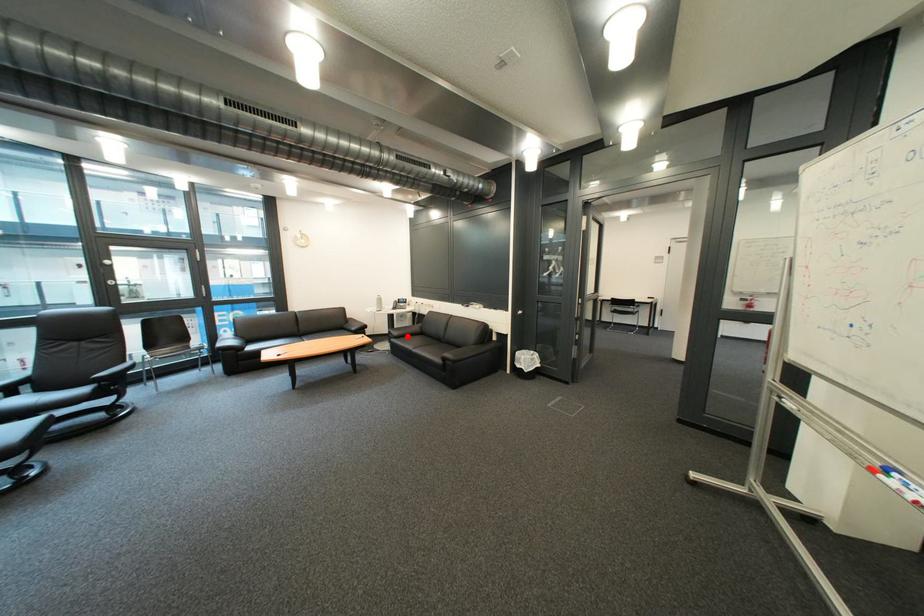
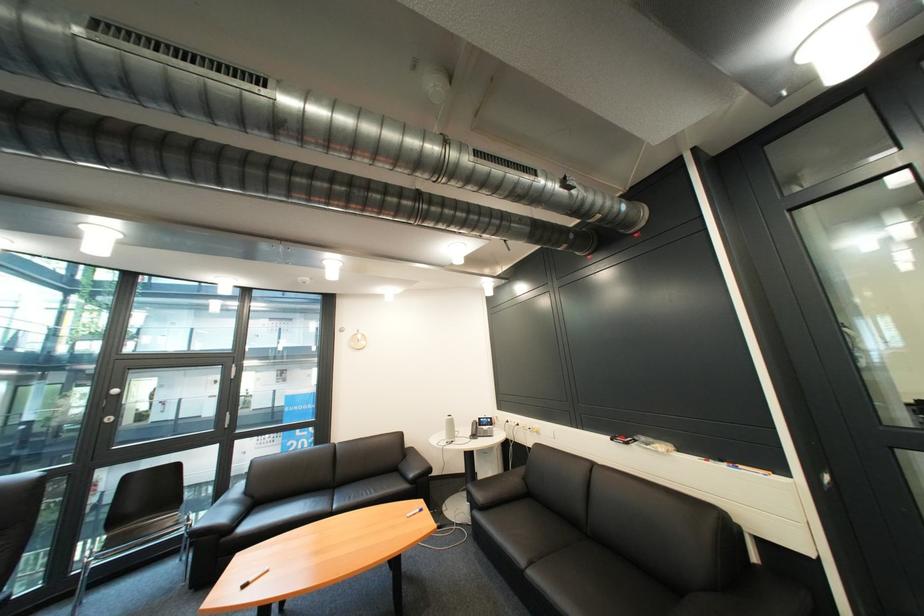
Question: I am providing you with two images of the same scene from different viewpoints. Image1 has a red point marked. In image2, the corresponding 3D location appears at what relative position? Reply with the corresponding letter.

Choices:
 (A) Closer
 (B) Farther

Answer: (A)